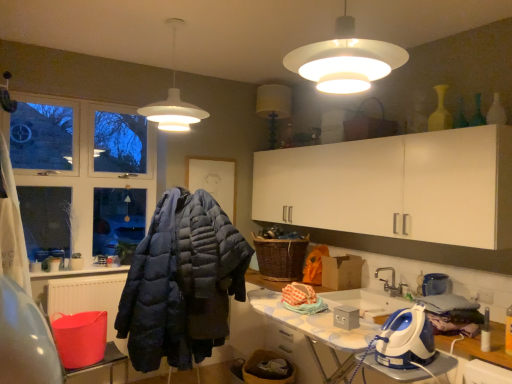
Question: From a real-world perspective, is woven brown laundry basket at center positioned over white matte lampshade at upper center, which is the 1th lamp from right to left, based on gravity?

Choices:
 (A) no
 (B) yes

Answer: (A)

Question: Is woven brown laundry basket at center shorter than white matte lampshade at upper center, arranged as the first lamp when viewed from the front?

Choices:
 (A) no
 (B) yes

Answer: (B)

Question: Is woven brown laundry basket at center outside white matte lampshade at upper center, which is the 1th lamp from right to left?

Choices:
 (A) yes
 (B) no

Answer: (A)

Question: Is woven brown laundry basket at center aimed at white matte lampshade at upper center, the second lamp from the back?

Choices:
 (A) no
 (B) yes

Answer: (A)

Question: From the image's perspective, would you say woven brown laundry basket at center is positioned over white matte lampshade at upper center, arranged as the first lamp when viewed from the front?

Choices:
 (A) no
 (B) yes

Answer: (A)

Question: Based on their sizes in the image, would you say white matte pendant light at upper center, the first lamp when ordered from back to front, is bigger or smaller than white matte lampshade at upper center, the second lamp from the back?

Choices:
 (A) big
 (B) small

Answer: (A)

Question: From the image's perspective, is white matte pendant light at upper center, which appears as the second lamp when viewed from the front, located above or below white matte lampshade at upper center, arranged as the first lamp when viewed from the front?

Choices:
 (A) below
 (B) above

Answer: (B)

Question: Would you say white matte pendant light at upper center, which is counted as the 1th lamp, starting from the left, is inside or outside white matte lampshade at upper center, arranged as the first lamp when viewed from the front?

Choices:
 (A) inside
 (B) outside

Answer: (B)

Question: Considering the positions of white matte pendant light at upper center, the first lamp when ordered from back to front, and white matte lampshade at upper center, which is the 1th lamp from right to left, in the image, is white matte pendant light at upper center, the first lamp when ordered from back to front, wider or thinner than white matte lampshade at upper center, which is the 1th lamp from right to left,?

Choices:
 (A) wide
 (B) thin

Answer: (A)

Question: Would you say silver metallic faucet at lower center is to the left or to the right of dark blue quilted jacket at center in the picture?

Choices:
 (A) left
 (B) right

Answer: (B)

Question: Is silver metallic faucet at lower center inside the boundaries of dark blue quilted jacket at center, or outside?

Choices:
 (A) inside
 (B) outside

Answer: (B)

Question: From the image's perspective, is silver metallic faucet at lower center positioned above or below dark blue quilted jacket at center?

Choices:
 (A) below
 (B) above

Answer: (B)

Question: Considering the positions of point (384, 283) and point (189, 266), is point (384, 283) closer or farther from the camera than point (189, 266)?

Choices:
 (A) closer
 (B) farther

Answer: (B)

Question: Considering their positions, is white matte pendant light at upper center, which appears as the second lamp when viewed from the front, located in front of or behind silver metallic faucet at lower center?

Choices:
 (A) behind
 (B) front

Answer: (B)

Question: In terms of width, does white matte pendant light at upper center, which appears as the second lamp when viewed from the front, look wider or thinner when compared to silver metallic faucet at lower center?

Choices:
 (A) thin
 (B) wide

Answer: (B)